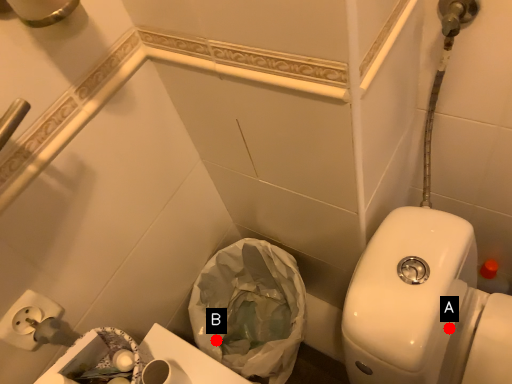
Question: Two points are circled on the image, labeled by A and B beside each circle. Among these points, which one is farthest from the camera?

Choices:
 (A) A is further
 (B) B is further

Answer: (B)